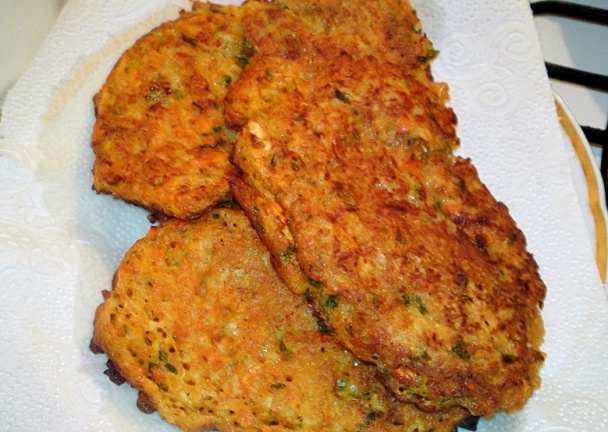
Where is `white paper towel`? The height and width of the screenshot is (432, 608). white paper towel is located at coordinates (489, 42).